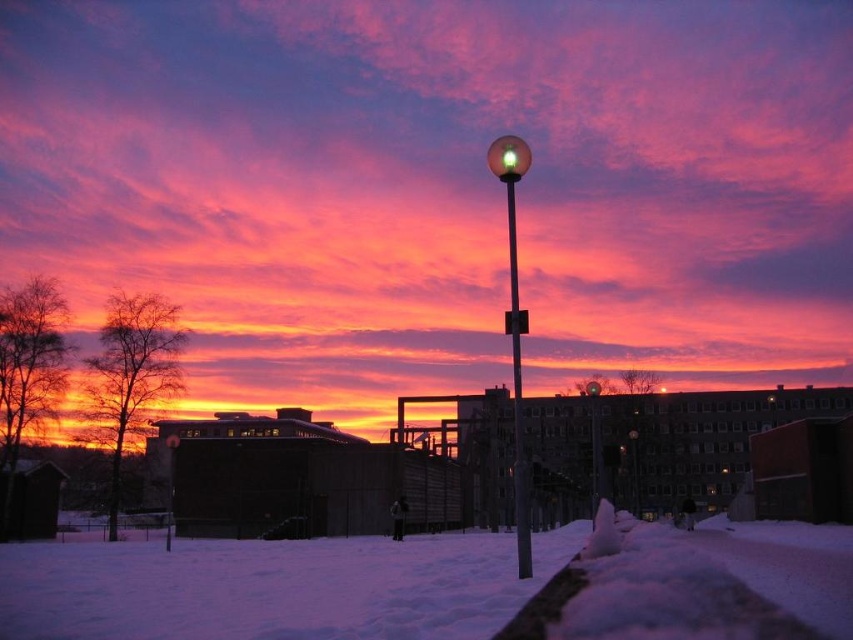
Question: Which point is farther from the camera taking this photo?

Choices:
 (A) (596, 445)
 (B) (637, 467)

Answer: (B)

Question: Among these points, which one is farthest from the camera?

Choices:
 (A) (41, 634)
 (B) (595, 461)
 (C) (636, 509)
 (D) (526, 317)

Answer: (C)

Question: Does white fluffy snow at lower center come in front of glossy glass sphere at center?

Choices:
 (A) no
 (B) yes

Answer: (B)

Question: Is translucent glass globe at center positioned at the back of matte glass street light at center?

Choices:
 (A) no
 (B) yes

Answer: (A)

Question: Which object is positioned closest to the glossy glass sphere at center?

Choices:
 (A) green glass street light at center
 (B) translucent glass globe at center
 (C) white fluffy snow at lower center
 (D) matte glass street light at center

Answer: (D)

Question: Is glossy glass sphere at center above matte glass street light at center?

Choices:
 (A) yes
 (B) no

Answer: (A)